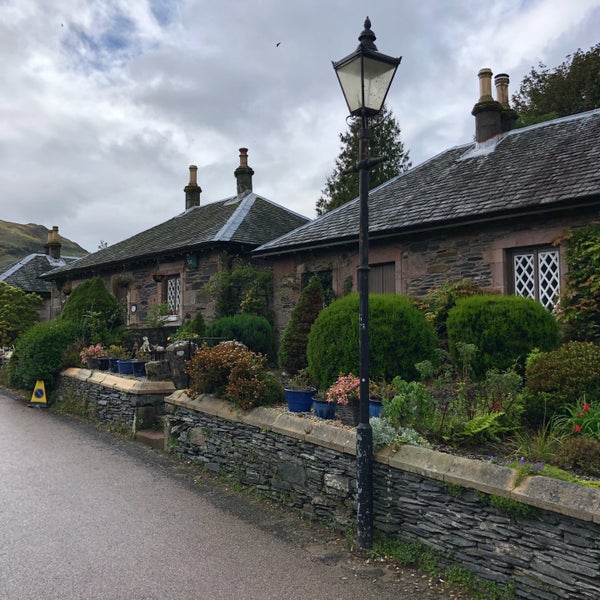
Image resolution: width=600 pixels, height=600 pixels. I want to click on iron, so pyautogui.click(x=355, y=399).